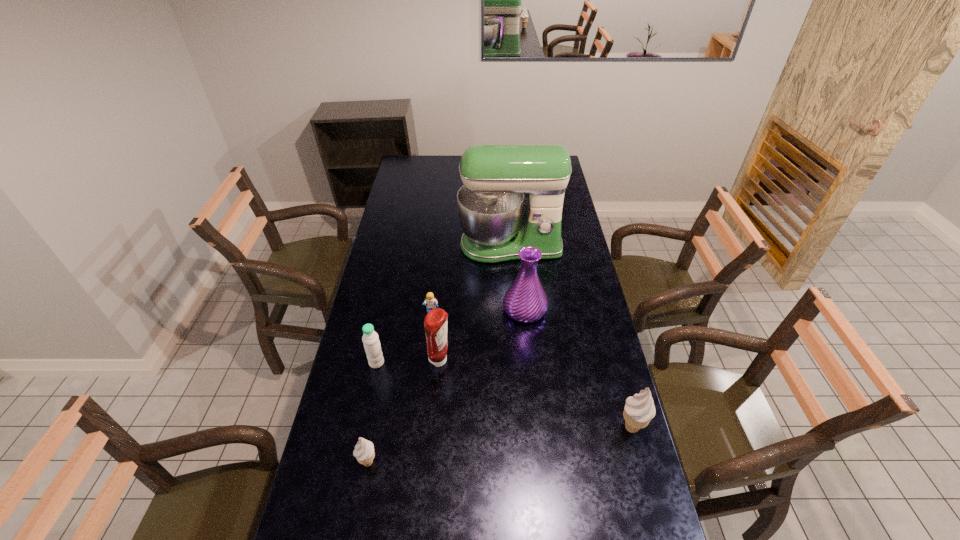
I want to click on free space between the vase and the second nearest object, so click(578, 369).

I want to click on free spot between the condiment and the vase, so click(482, 335).

This screenshot has width=960, height=540. In order to click on blank region between the mixer and the Lego in this screenshot , I will do `click(471, 278)`.

What are the coordinates of `free space that is in between the Lego and the second tallest object` in the screenshot? It's located at (478, 310).

Identify the location of vacant space that is in between the shortest object and the mixer. (471, 278).

This screenshot has width=960, height=540. What are the coordinates of `vacant area that lies between the second tallest object and the water bottle` in the screenshot? It's located at (450, 336).

Locate an element on the screen. vacant area between the condiment and the shorter icecream is located at coordinates (404, 411).

Locate an element on the screen. blank region between the Lego and the water bottle is located at coordinates (404, 337).

I want to click on the third closest object relative to the vase, so click(x=431, y=302).

Find the location of a particular element. the fourth closest object to the mixer is located at coordinates (370, 338).